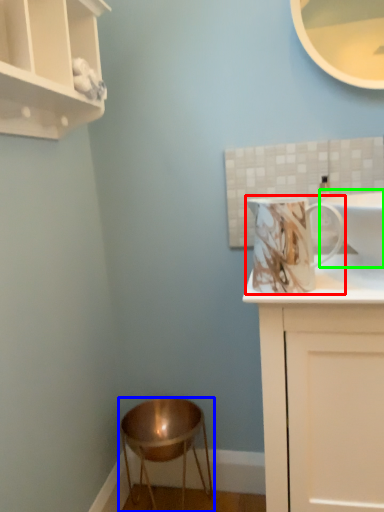
Question: Which is farther away from mug (highlighted by a red box)? stool (highlighted by a blue box) or sink (highlighted by a green box)?

Choices:
 (A) stool
 (B) sink

Answer: (A)